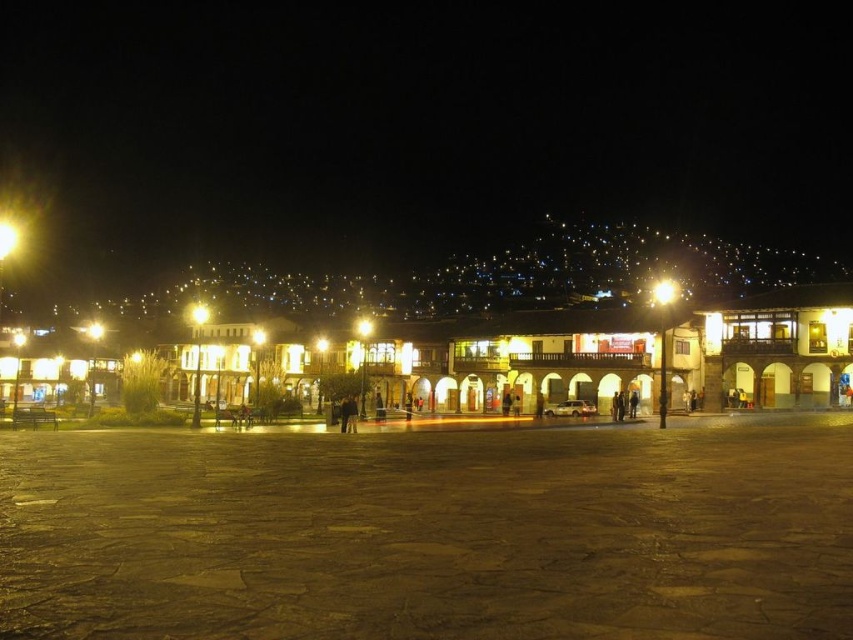
Question: Among these objects, which one is farthest from the camera?

Choices:
 (A) yellow metallic streetlight at left
 (B) yellow glass streetlight at center
 (C) bright metallic streetlight at upper center
 (D) brown stone pavement at center

Answer: (B)

Question: Can you confirm if bright metallic streetlight at upper center is positioned to the right of yellow metallic streetlight at left?

Choices:
 (A) no
 (B) yes

Answer: (B)

Question: Which object is farther from the camera taking this photo?

Choices:
 (A) yellow glass streetlight at center
 (B) brown stone pavement at center
 (C) bright metallic streetlight at upper center

Answer: (A)

Question: Is brown stone pavement at center above bright metallic streetlight at upper center?

Choices:
 (A) yes
 (B) no

Answer: (B)

Question: Is brown stone pavement at center below bright metallic streetlight at upper center?

Choices:
 (A) yes
 (B) no

Answer: (A)

Question: Which of the following is the closest to the observer?

Choices:
 (A) yellow metallic streetlight at left
 (B) yellow glass streetlight at center

Answer: (A)